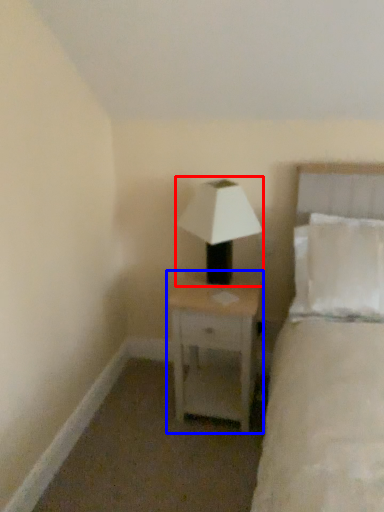
Question: Which object appears farthest to the camera in this image, lamp (highlighted by a red box) or nightstand (highlighted by a blue box)?

Choices:
 (A) lamp
 (B) nightstand

Answer: (B)